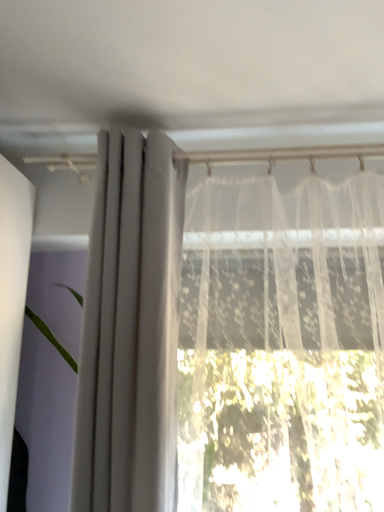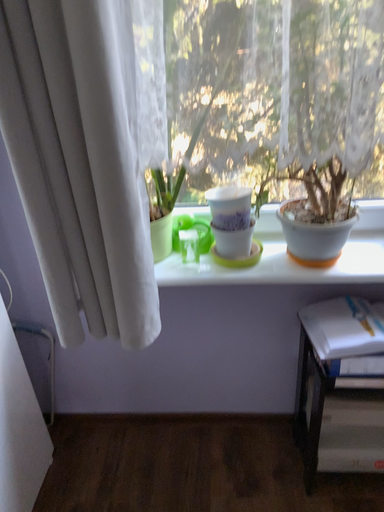
Question: Which way did the camera rotate in the video?

Choices:
 (A) rotated downward
 (B) rotated upward

Answer: (A)